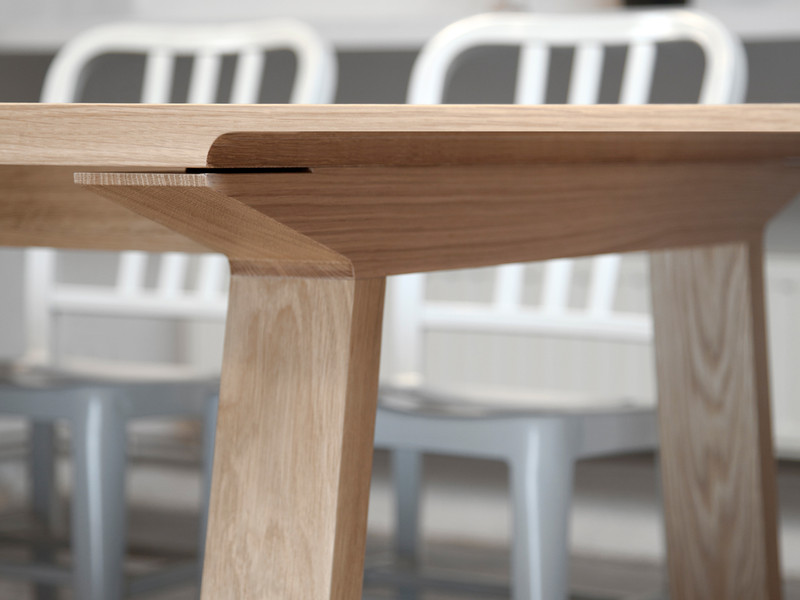
Locate an element on the screen. Image resolution: width=800 pixels, height=600 pixels. chair on left is located at coordinates (154, 67).